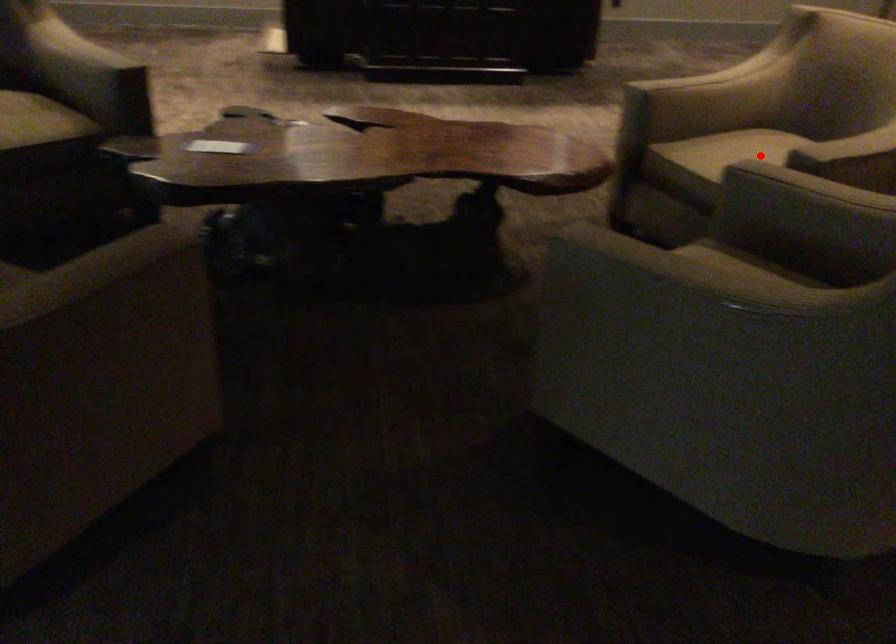
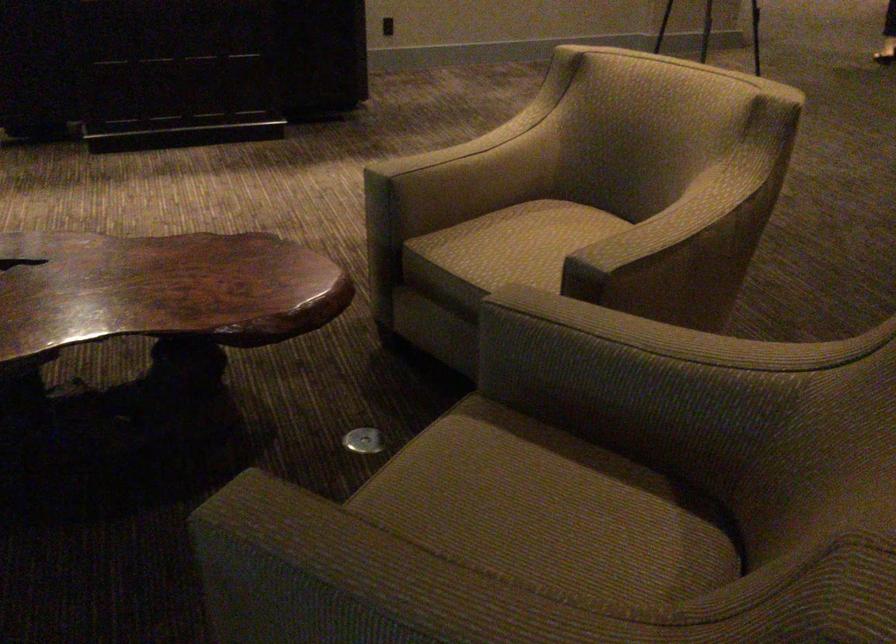
Question: I am providing you with two images of the same scene from different viewpoints. Image1 has a red point marked. In image2, the corresponding 3D location appears at what relative position? Reply with the corresponding letter.

Choices:
 (A) Closer
 (B) Farther

Answer: (A)